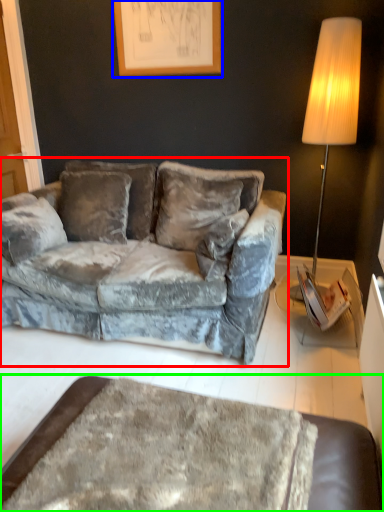
Question: Which object is the closest to the studio couch (highlighted by a red box)? Choose among these: picture frame (highlighted by a blue box) or table (highlighted by a green box).

Choices:
 (A) picture frame
 (B) table

Answer: (A)